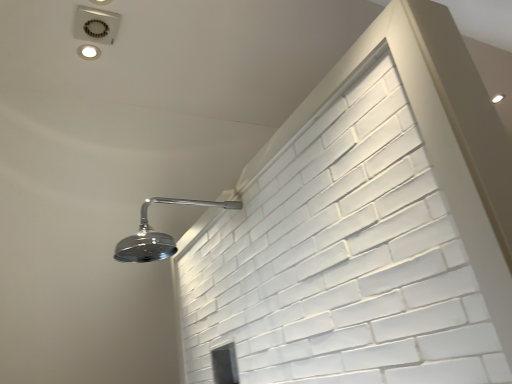
Question: Is matte silver droplight at upper right, which is the first droplight from right to left, inside or outside of matte white droplight at upper left, placed as the second droplight when sorted from right to left?

Choices:
 (A) outside
 (B) inside

Answer: (A)

Question: In terms of height, does matte silver droplight at upper right, marked as the 1th droplight in a back-to-front arrangement, look taller or shorter compared to matte white droplight at upper left, placed as the second droplight when sorted from right to left?

Choices:
 (A) tall
 (B) short

Answer: (B)

Question: Considering the real-world distances, which object is farthest from the chrome metallic shower head at upper left?

Choices:
 (A) matte silver droplight at upper right, marked as the 2th droplight in a front-to-back arrangement
 (B) matte white droplight at upper left, which ranks as the second droplight in back-to-front order

Answer: (A)

Question: Considering the real-world distances, which object is closest to the chrome metallic shower head at upper left?

Choices:
 (A) matte silver droplight at upper right, marked as the 1th droplight in a back-to-front arrangement
 (B) matte white droplight at upper left, which ranks as the second droplight in back-to-front order

Answer: (B)